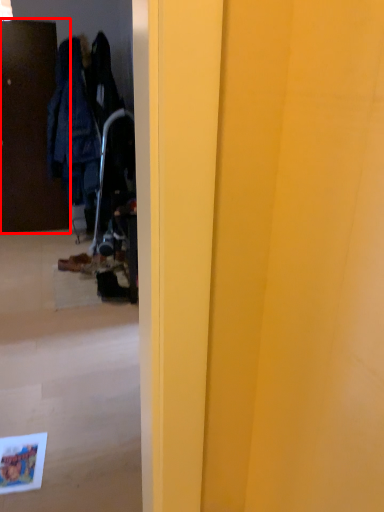
Question: In this image, where is door (annotated by the red box) located relative to footwear?

Choices:
 (A) left
 (B) right

Answer: (A)